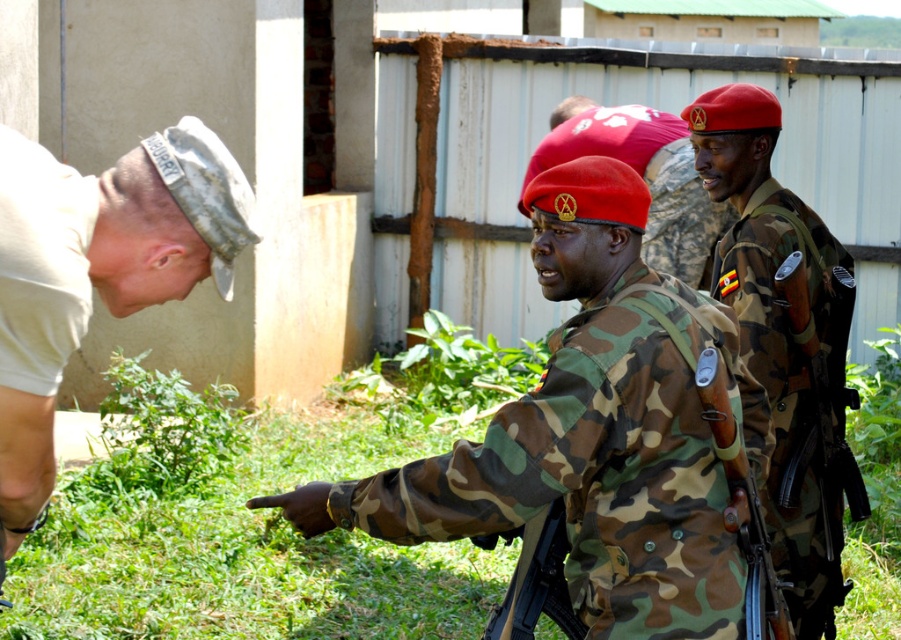
Question: Is camo fabric uniform at right wider than white cotton t-shirt at left?

Choices:
 (A) yes
 (B) no

Answer: (A)

Question: Does white cotton t-shirt at left have a smaller size compared to camouflage uniform at center?

Choices:
 (A) yes
 (B) no

Answer: (A)

Question: In this image, where is white matte cap at lower left located relative to white cotton t-shirt at left?

Choices:
 (A) left
 (B) right

Answer: (B)

Question: Which point appears closest to the camera in this image?

Choices:
 (A) (660, 131)
 (B) (790, 442)

Answer: (B)

Question: Considering the real-world distances, which object is farthest from the white matte cap at lower left?

Choices:
 (A) camouflage uniform at center
 (B) white cotton t-shirt at left
 (C) camouflage fabric uniform at center
 (D) camo fabric uniform at right

Answer: (A)

Question: Which of these objects is positioned closest to the camouflage fabric uniform at center?

Choices:
 (A) camouflage uniform at center
 (B) camo fabric uniform at right
 (C) white cotton t-shirt at left

Answer: (B)